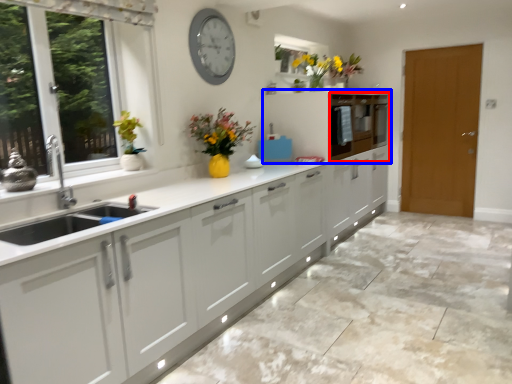
Question: Which point is closer to the camera, cabinetry (highlighted by a red box) or cabinetry (highlighted by a blue box)?

Choices:
 (A) cabinetry
 (B) cabinetry

Answer: (B)